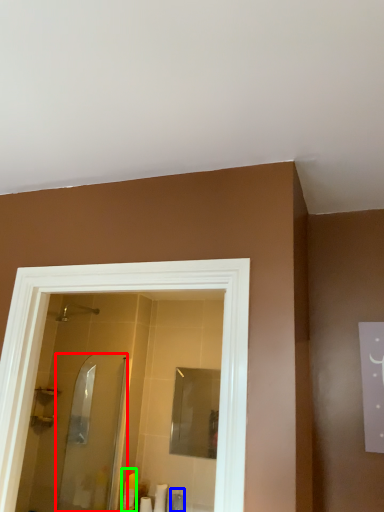
Question: Considering the real-world distances, which object is farthest from screen door (highlighted by a red box)? toiletry (highlighted by a blue box) or toiletry (highlighted by a green box)?

Choices:
 (A) toiletry
 (B) toiletry

Answer: (A)